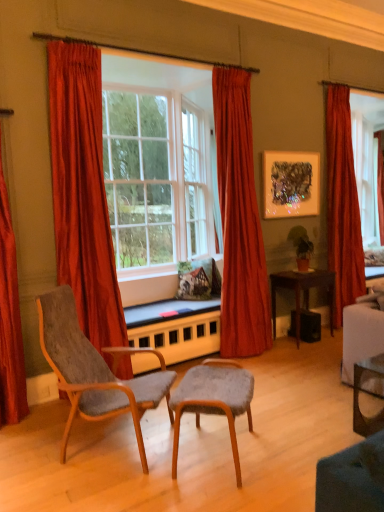
Where is `free space in front of velvet grey stool at center, placed as the 1th chair when sorted from right to left`? Image resolution: width=384 pixels, height=512 pixels. free space in front of velvet grey stool at center, placed as the 1th chair when sorted from right to left is located at coordinates (211, 495).